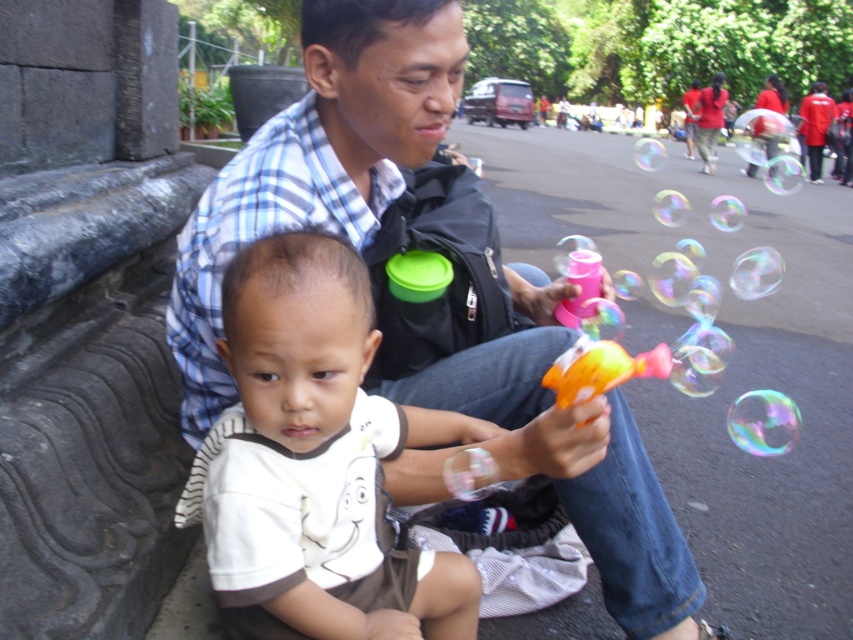
Question: Which is farther from the orange plastic toy at lower center?

Choices:
 (A) white cotton shirt at center
 (B) matte blue shirt at center

Answer: (B)

Question: Is matte blue shirt at center positioned behind white cotton shirt at center?

Choices:
 (A) yes
 (B) no

Answer: (A)

Question: Which point is closer to the camera?

Choices:
 (A) (242, 152)
 (B) (619, 378)

Answer: (B)

Question: Where is matte blue shirt at center located in relation to orange plastic toy at lower center in the image?

Choices:
 (A) left
 (B) right

Answer: (A)

Question: Which object is farther from the camera taking this photo?

Choices:
 (A) matte blue shirt at center
 (B) orange plastic toy at lower center
 (C) white cotton shirt at center

Answer: (B)

Question: In this image, where is matte blue shirt at center located relative to orange plastic toy at lower center?

Choices:
 (A) below
 (B) above

Answer: (B)